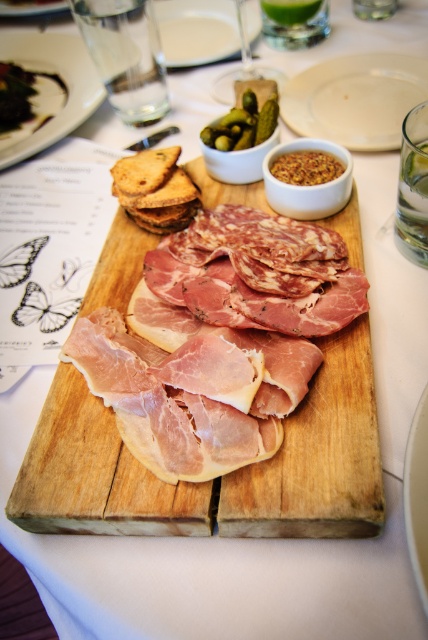
Question: Does wooden cutting board at center have a larger size compared to white matte plate at upper center?

Choices:
 (A) no
 (B) yes

Answer: (B)

Question: Is white glossy plate at center behind brown crumbly spread at center?

Choices:
 (A) no
 (B) yes

Answer: (A)

Question: Which object is positioned closest to the wooden cutting board at center?

Choices:
 (A) white porcelain plate at upper center
 (B) white glossy plate at center

Answer: (B)

Question: Is white matte plate at upper center wider than white glossy plate at center?

Choices:
 (A) no
 (B) yes

Answer: (B)

Question: Which object is positioned farthest from the white matte plate at upper center?

Choices:
 (A) white glossy plate at center
 (B) white porcelain plate at upper center
 (C) brown crumbly spread at center

Answer: (A)

Question: Which object is positioned farthest from the brown crumbly spread at center?

Choices:
 (A) white matte plate at upper center
 (B) wooden cutting board at center

Answer: (B)